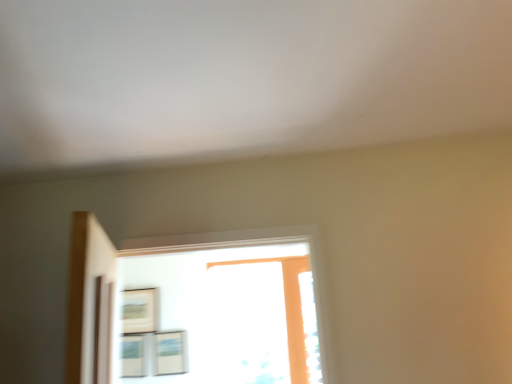
Question: Can you confirm if matte black picture frame at upper left, arranged as the third picture frame when viewed from the right, is taller than matte white picture frame at lower left, arranged as the 2th picture frame when viewed from the right?

Choices:
 (A) yes
 (B) no

Answer: (A)

Question: Is matte black picture frame at upper left, the first picture frame when ordered from left to right, not inside matte white picture frame at lower left, marked as the second picture frame in a left-to-right arrangement?

Choices:
 (A) yes
 (B) no

Answer: (A)

Question: From the image's perspective, is matte black picture frame at upper left, arranged as the third picture frame when viewed from the right, on matte white picture frame at lower left, arranged as the 2th picture frame when viewed from the right?

Choices:
 (A) yes
 (B) no

Answer: (A)

Question: Could you tell me if matte black picture frame at upper left, the first picture frame when ordered from left to right, is facing matte white picture frame at lower left, marked as the second picture frame in a left-to-right arrangement?

Choices:
 (A) yes
 (B) no

Answer: (B)

Question: Does matte black picture frame at upper left, arranged as the third picture frame when viewed from the right, appear on the right side of matte white picture frame at lower left, marked as the second picture frame in a left-to-right arrangement?

Choices:
 (A) no
 (B) yes

Answer: (A)

Question: Is matte black picture frame at upper left, the first picture frame when ordered from left to right, in contact with matte white picture frame at lower left, arranged as the 2th picture frame when viewed from the right?

Choices:
 (A) no
 (B) yes

Answer: (A)

Question: From a real-world perspective, is matte wooden picture frame at center, the third picture frame from the left, on matte black picture frame at upper left, arranged as the third picture frame when viewed from the right?

Choices:
 (A) yes
 (B) no

Answer: (B)

Question: From the image's perspective, would you say matte wooden picture frame at center, the third picture frame from the left, is positioned over matte black picture frame at upper left, arranged as the third picture frame when viewed from the right?

Choices:
 (A) no
 (B) yes

Answer: (A)

Question: Is matte wooden picture frame at center, which ranks as the first picture frame in right-to-left order, beside matte black picture frame at upper left, the first picture frame when ordered from left to right?

Choices:
 (A) yes
 (B) no

Answer: (B)

Question: Would you say matte wooden picture frame at center, the third picture frame from the left, is outside matte black picture frame at upper left, arranged as the third picture frame when viewed from the right?

Choices:
 (A) yes
 (B) no

Answer: (A)

Question: Is matte wooden picture frame at center, the third picture frame from the left, behind matte black picture frame at upper left, the first picture frame when ordered from left to right?

Choices:
 (A) yes
 (B) no

Answer: (B)

Question: Is matte wooden picture frame at center, the third picture frame from the left, facing towards matte black picture frame at upper left, arranged as the third picture frame when viewed from the right?

Choices:
 (A) no
 (B) yes

Answer: (A)

Question: Is matte wooden picture frame at center, the third picture frame from the left, completely or partially outside of matte white picture frame at lower left, arranged as the 2th picture frame when viewed from the right?

Choices:
 (A) yes
 (B) no

Answer: (A)